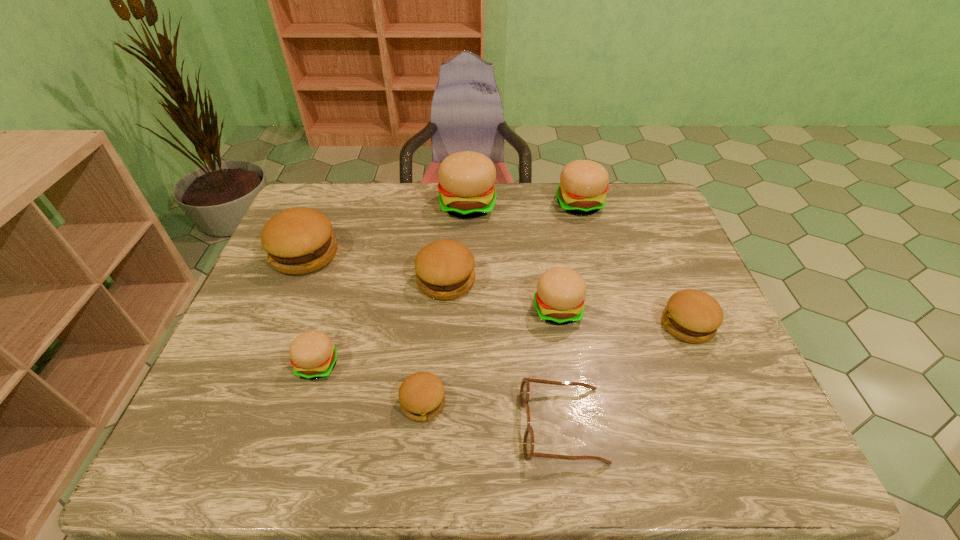
What are the coordinates of `the smallest brown hamburger` in the screenshot? It's located at (421, 395).

The height and width of the screenshot is (540, 960). In order to click on the shortest hamburger in this screenshot , I will do `click(421, 395)`.

What are the coordinates of `spectacles` in the screenshot? It's located at (528, 441).

This screenshot has height=540, width=960. Identify the location of free space located on the front of the biggest beige hamburger. (467, 234).

This screenshot has height=540, width=960. Identify the location of vacant space situated on the left of the third smallest beige hamburger. coord(492,204).

I want to click on vacant position located on the right of the biggest brown hamburger, so click(x=406, y=254).

This screenshot has height=540, width=960. Identify the location of vacant space located on the front of the second smallest beige hamburger. (565, 360).

The image size is (960, 540). Find the location of `free space located on the right of the second biggest brown hamburger`. free space located on the right of the second biggest brown hamburger is located at coordinates (612, 281).

Locate an element on the screen. This screenshot has width=960, height=540. free region located 0.290m on the front of the rightmost object is located at coordinates (748, 467).

You are a GUI agent. You are given a task and a screenshot of the screen. Output one action in this format:
    pyautogui.click(x=<x>, y=<y>)
    Task: Click on the vacant space positioned on the front of the smallest beige hamburger
    This screenshot has height=540, width=960.
    Given the screenshot: What is the action you would take?
    pyautogui.click(x=297, y=434)